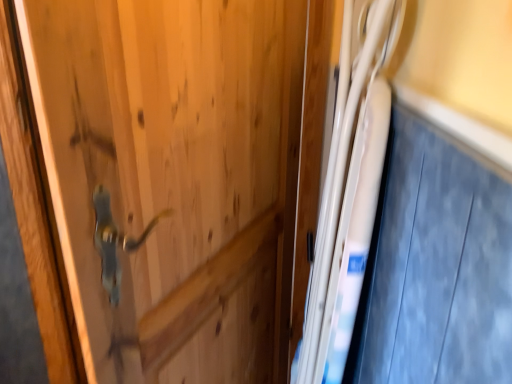
What do you see at coordinates (350, 186) in the screenshot? I see `white glossy fridge at right` at bounding box center [350, 186].

Find the location of a particular element. The height and width of the screenshot is (384, 512). white glossy fridge at right is located at coordinates (350, 186).

The height and width of the screenshot is (384, 512). Describe the element at coordinates (436, 265) in the screenshot. I see `white glossy bed at right` at that location.

What are the coordinates of `white glossy bed at right` in the screenshot? It's located at (436, 265).

From the picture: What is the approximate height of white glossy bed at right?

82.06 centimeters.

The height and width of the screenshot is (384, 512). Find the location of `white glossy fridge at right`. white glossy fridge at right is located at coordinates (350, 186).

Considering the relative positions of white glossy fridge at right and white glossy bed at right in the image provided, is white glossy fridge at right to the left or to the right of white glossy bed at right?

Clearly, white glossy fridge at right is on the left of white glossy bed at right in the image.

Is white glossy fridge at right in front of or behind white glossy bed at right in the image?

white glossy fridge at right is positioned farther from the viewer than white glossy bed at right.

Consider the image. Which is less distant, (375, 82) or (496, 217)?

Point (375, 82) is positioned farther from the camera compared to point (496, 217).

From the image's perspective, between white glossy fridge at right and white glossy bed at right, which one is located above?

white glossy bed at right.

From a real-world perspective, relative to white glossy bed at right, is white glossy fridge at right vertically above or below?

In terms of real-world spatial position, white glossy fridge at right is below white glossy bed at right.

Between white glossy fridge at right and white glossy bed at right, which one has larger width?

white glossy fridge at right is wider.

Is white glossy fridge at right taller or shorter than white glossy bed at right?

white glossy fridge at right is taller than white glossy bed at right.

Considering the relative sizes of white glossy fridge at right and white glossy bed at right in the image provided, is white glossy fridge at right bigger than white glossy bed at right?

Correct, white glossy fridge at right is larger in size than white glossy bed at right.

Can we say white glossy fridge at right lies outside white glossy bed at right?

Absolutely, white glossy fridge at right is external to white glossy bed at right.

Is white glossy fridge at right far from white glossy bed at right?

white glossy fridge at right is near white glossy bed at right, not far away.

Could you tell me if white glossy fridge at right is facing white glossy bed at right?

Yes, white glossy fridge at right is turned towards white glossy bed at right.

Find the location of a particular element. The height and width of the screenshot is (384, 512). fridge on the left of the white glossy bed at right is located at coordinates (350, 186).

Between white glossy bed at right and white glossy fridge at right, which one appears on the left side from the viewer's perspective?

white glossy fridge at right.

Is white glossy bed at right closer to camera compared to white glossy fridge at right?

Yes, white glossy bed at right is closer to the viewer.

Which point is more forward, (368, 271) or (349, 1)?

Positioned in front is point (368, 271).

From the image's perspective, between white glossy bed at right and white glossy fridge at right, which one is located above?

white glossy bed at right.

From a real-world perspective, which is physically above, white glossy bed at right or white glossy fridge at right?

From a 3D spatial view, white glossy bed at right is above.

In terms of width, does white glossy bed at right look wider or thinner when compared to white glossy fridge at right?

In the image, white glossy bed at right appears to be more narrow than white glossy fridge at right.

Considering the sizes of objects white glossy bed at right and white glossy fridge at right in the image provided, who is shorter, white glossy bed at right or white glossy fridge at right?

white glossy bed at right.

Considering the relative sizes of white glossy bed at right and white glossy fridge at right in the image provided, is white glossy bed at right bigger than white glossy fridge at right?

No.

Can we say white glossy bed at right lies outside white glossy fridge at right?

Yes, white glossy bed at right is located beyond the bounds of white glossy fridge at right.

Is white glossy bed at right next to white glossy fridge at right and touching it?

No, white glossy bed at right is not touching white glossy fridge at right.

In the scene shown: Could you tell me if white glossy bed at right is turned towards white glossy fridge at right?

Yes.

Can you tell me how much white glossy bed at right and white glossy fridge at right differ in facing direction?

1.21 degrees.

The width and height of the screenshot is (512, 384). In order to click on car door that is above the white glossy fridge at right (from a real-world perspective) in this screenshot , I will do `click(436, 265)`.

The width and height of the screenshot is (512, 384). Find the location of `fridge to the left of white glossy bed at right`. fridge to the left of white glossy bed at right is located at coordinates (350, 186).

The height and width of the screenshot is (384, 512). Identify the location of car door lying on the right of white glossy fridge at right. (436, 265).